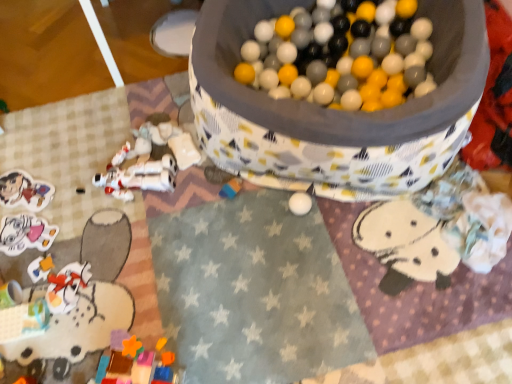
This screenshot has width=512, height=384. I want to click on empty space that is in between white plastic astronaut at lower left, placed as the 4th toy when sorted from left to right, and fluffy white blanket at lower right, which appears as the sixth toy when viewed from the left, so click(x=285, y=217).